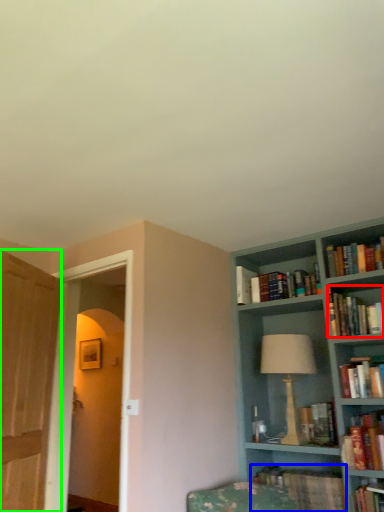
Question: Which object is the closest to the book (highlighted by a red box)? Choose among these: book (highlighted by a blue box) or glass door (highlighted by a green box).

Choices:
 (A) book
 (B) glass door

Answer: (A)